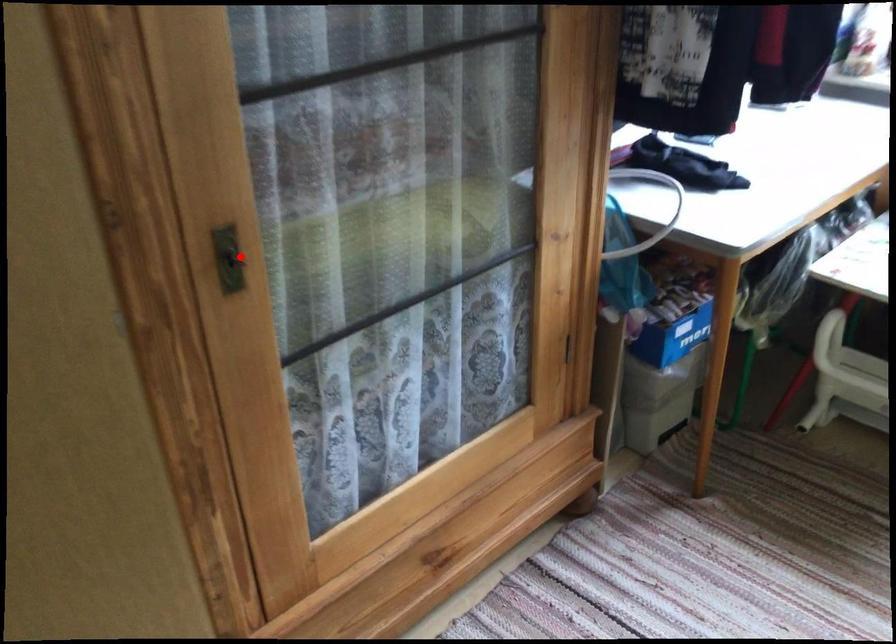
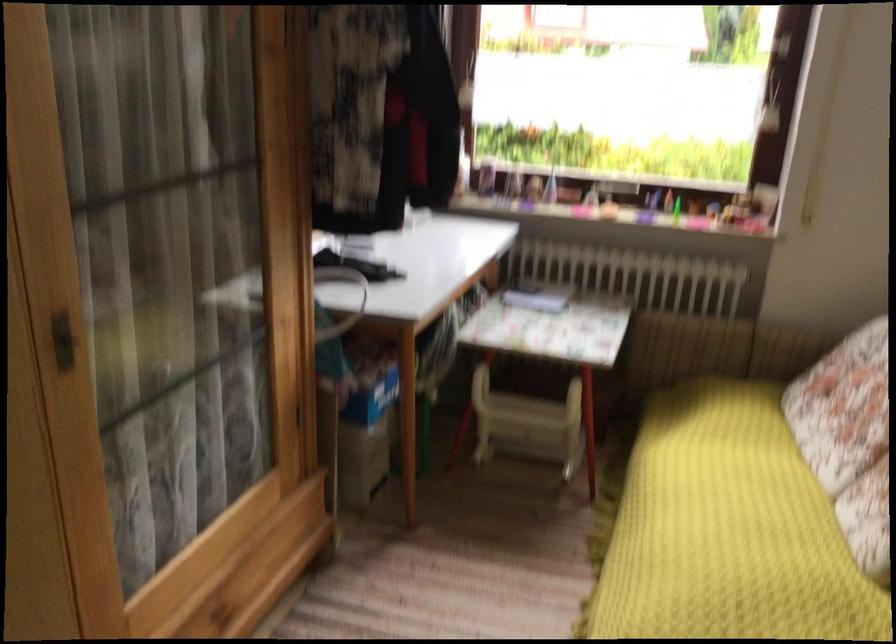
Where in the second image is the point corresponding to the highlighted location from the first image?

(63, 341)